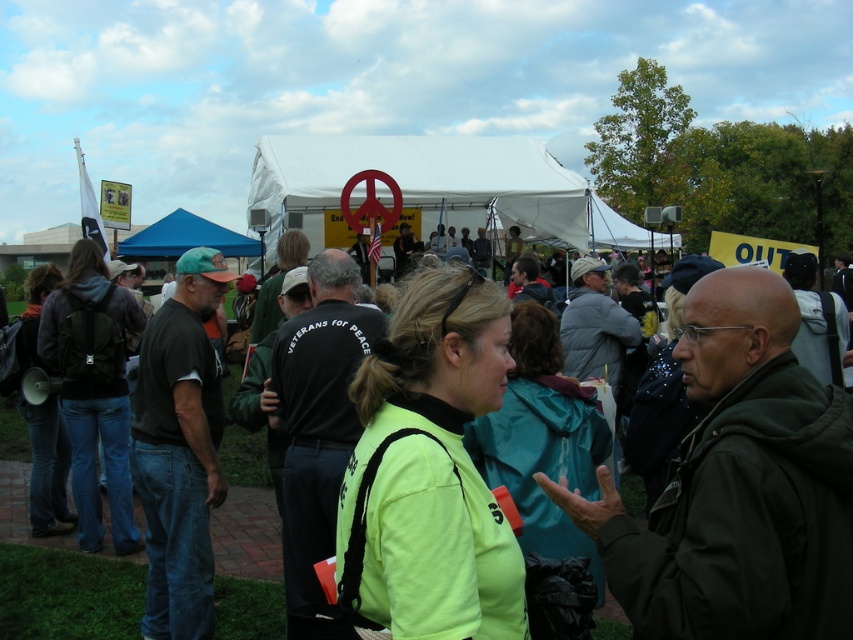
Which is in front, point (543, 202) or point (132, 244)?

Positioned in front is point (132, 244).

Is white fabric tent at center smaller than blue fabric canopy at center?

No.

In order to click on white fabric tent at center in this screenshot , I will do `click(437, 186)`.

Find the location of a particular element. The image size is (853, 640). white fabric tent at center is located at coordinates (437, 186).

Which is more to the left, white fabric tent at center or neon yellow jacket at center?

Positioned to the left is neon yellow jacket at center.

Is white fabric tent at center above neon yellow jacket at center?

Correct, white fabric tent at center is located above neon yellow jacket at center.

Is point (520, 212) closer to camera compared to point (233, 588)?

No, (520, 212) is behind (233, 588).

Image resolution: width=853 pixels, height=640 pixels. Identify the location of white fabric tent at center. (437, 186).

Does neon yellow jacket at center have a lesser width compared to blue fabric canopy at center?

Yes.

Does neon yellow jacket at center appear on the left side of blue fabric canopy at center?

No, neon yellow jacket at center is not to the left of blue fabric canopy at center.

Where is `neon yellow jacket at center`? This screenshot has width=853, height=640. neon yellow jacket at center is located at coordinates point(67,595).

Find the location of a particular element. The image size is (853, 640). neon yellow jacket at center is located at coordinates (67, 595).